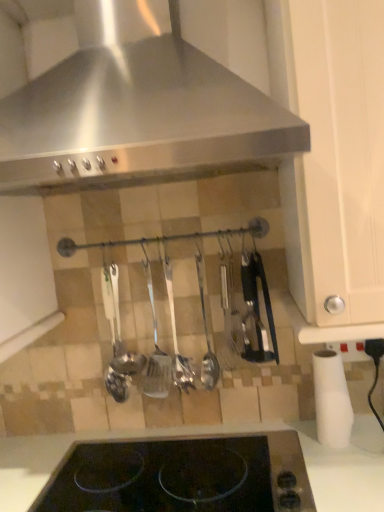
Question: Does white matte cabinet at right have a greater width compared to polished metal ladle at center, marked as the 2th silverware in a right-to-left arrangement?

Choices:
 (A) no
 (B) yes

Answer: (B)

Question: Does white matte cabinet at right have a greater height compared to polished metal ladle at center, which is the second silverware in left-to-right order?

Choices:
 (A) no
 (B) yes

Answer: (B)

Question: From the image's perspective, is white matte cabinet at right under polished metal ladle at center, marked as the 2th silverware in a right-to-left arrangement?

Choices:
 (A) yes
 (B) no

Answer: (B)

Question: Does white matte cabinet at right lie behind polished metal ladle at center, marked as the 2th silverware in a right-to-left arrangement?

Choices:
 (A) no
 (B) yes

Answer: (A)

Question: Could you tell me if white matte cabinet at right is turned towards polished metal ladle at center, marked as the 2th silverware in a right-to-left arrangement?

Choices:
 (A) no
 (B) yes

Answer: (A)

Question: From their relative heights in the image, would you say stainless steel range hood at upper center is taller or shorter than white matte cabinet at right?

Choices:
 (A) short
 (B) tall

Answer: (A)

Question: In terms of size, does stainless steel range hood at upper center appear bigger or smaller than white matte cabinet at right?

Choices:
 (A) big
 (B) small

Answer: (A)

Question: Is stainless steel range hood at upper center in front of or behind white matte cabinet at right in the image?

Choices:
 (A) front
 (B) behind

Answer: (A)

Question: Is stainless steel range hood at upper center wider or thinner than white matte cabinet at right?

Choices:
 (A) wide
 (B) thin

Answer: (A)

Question: Does point click(x=374, y=194) appear closer or farther from the camera than point click(x=77, y=489)?

Choices:
 (A) closer
 (B) farther

Answer: (A)

Question: Is white matte cabinet at right situated inside black glass at center or outside?

Choices:
 (A) outside
 (B) inside

Answer: (A)

Question: Considering their positions, is white matte cabinet at right located in front of or behind black glass at center?

Choices:
 (A) front
 (B) behind

Answer: (A)

Question: From the image's perspective, is white matte cabinet at right positioned above or below black glass at center?

Choices:
 (A) below
 (B) above

Answer: (B)

Question: From their relative heights in the image, would you say polished metal ladle at center, the third silverware when ordered from left to right, is taller or shorter than polished metal ladle at center, marked as the 2th silverware in a right-to-left arrangement?

Choices:
 (A) tall
 (B) short

Answer: (A)

Question: Is polished metal ladle at center, arranged as the 1th silverware when viewed from the right, bigger or smaller than polished metal ladle at center, marked as the 2th silverware in a right-to-left arrangement?

Choices:
 (A) big
 (B) small

Answer: (B)